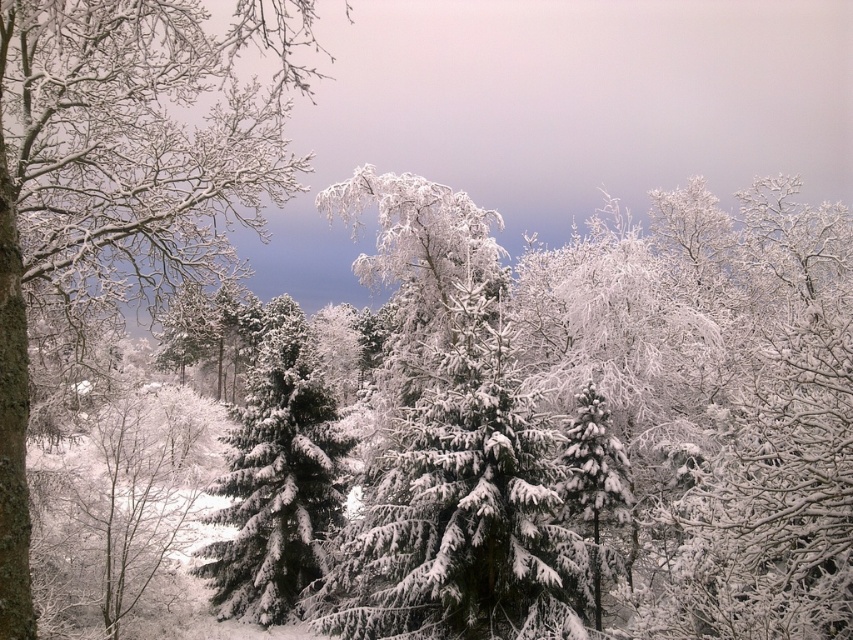
Between snow-covered branches at left and snow-covered evergreen at center, which one appears on the right side from the viewer's perspective?

Positioned to the right is snow-covered evergreen at center.

Is snow-covered branches at left closer to camera compared to snow-covered evergreen at center?

Yes, it is.

Does point (224, 145) come closer to viewer compared to point (331, 500)?

Yes, point (224, 145) is closer to viewer.

This screenshot has width=853, height=640. I want to click on snow-covered branches at left, so click(x=120, y=172).